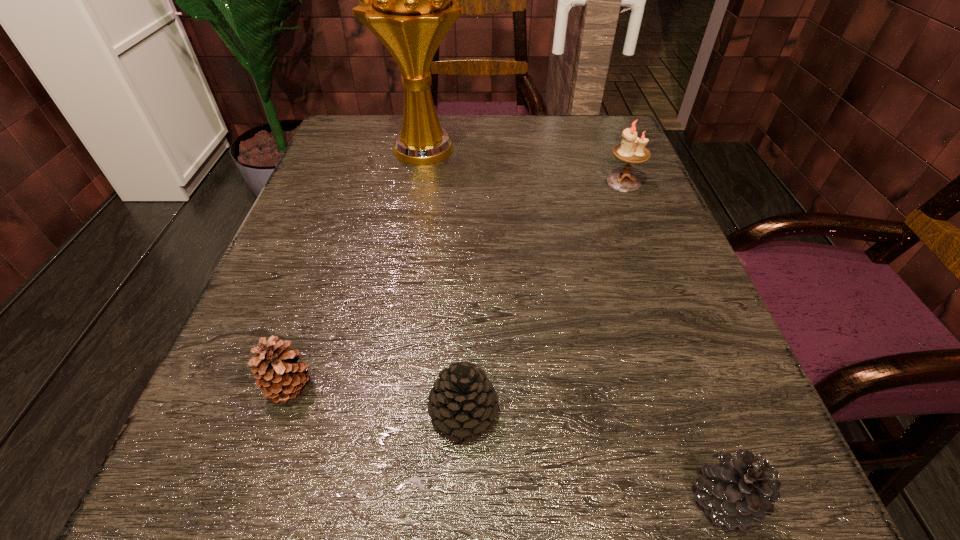
Find the location of a particular element. empty location between the trophy_cup and the second pinecone from right to left is located at coordinates (444, 281).

The image size is (960, 540). Find the location of `vacant area that lies between the rightmost pinecone and the second pinecone from right to left`. vacant area that lies between the rightmost pinecone and the second pinecone from right to left is located at coordinates (593, 456).

Where is `vacant area that lies between the second pinecone from left to right and the fourth shortest object`? Image resolution: width=960 pixels, height=540 pixels. vacant area that lies between the second pinecone from left to right and the fourth shortest object is located at coordinates (543, 298).

Where is `free space between the leftmost pinecone and the candle holder`? free space between the leftmost pinecone and the candle holder is located at coordinates coord(457,285).

Point out which object is positioned as the third nearest to the tallest object. Please provide its 2D coordinates. Your answer should be formatted as a tuple, i.e. [(x, y)], where the tuple contains the x and y coordinates of a point satisfying the conditions above.

[(462, 403)]

Locate which object ranks third in proximity to the nearest pinecone. Please provide its 2D coordinates. Your answer should be formatted as a tuple, i.e. [(x, y)], where the tuple contains the x and y coordinates of a point satisfying the conditions above.

[(632, 149)]

Identify the location of the closest pinecone to the fourth shortest object. The image size is (960, 540). tap(462, 403).

Find the location of `pinecone that is the second closest to the candle holder`. pinecone that is the second closest to the candle holder is located at coordinates pyautogui.click(x=740, y=491).

Identify the location of vacant space that satisfies the following two spatial constraints: 1. at the narrow end of the second pinecone from right to left; 2. on the back side of the nearest pinecone. (461, 500).

At what (x,y) coordinates should I click in order to perform the action: click on free space that satisfies the following two spatial constraints: 1. on the back side of the rightmost pinecone; 2. at the narrow end of the second pinecone from left to right. Please return your answer as a coordinate pair (x, y). This screenshot has width=960, height=540. Looking at the image, I should click on (692, 413).